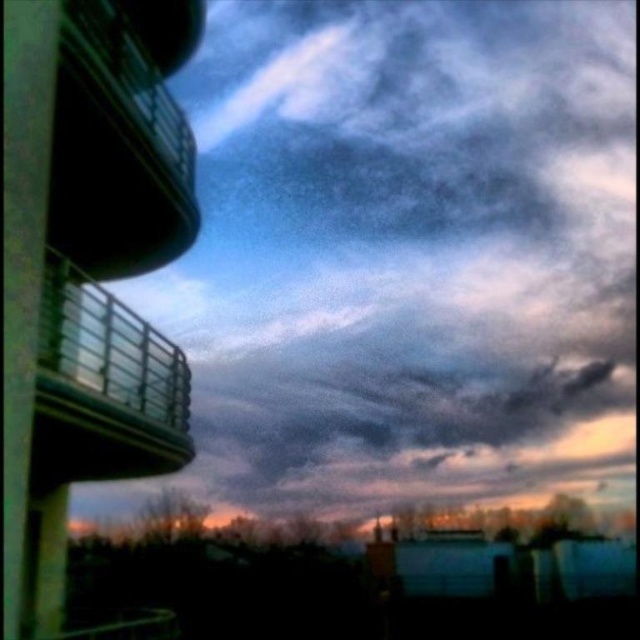
At what (x,y) coordinates should I click in order to perform the action: click on metallic balcony at left. Please return your answer as a coordinate pair (x, y). This screenshot has width=640, height=640. Looking at the image, I should click on (122, 136).

How much distance is there between metallic balcony at left and metallic glass balcony at upper left?

metallic balcony at left and metallic glass balcony at upper left are 21.25 feet apart from each other.

The width and height of the screenshot is (640, 640). Identify the location of metallic balcony at left. (122, 136).

In order to click on metallic balcony at left in this screenshot , I will do `click(122, 136)`.